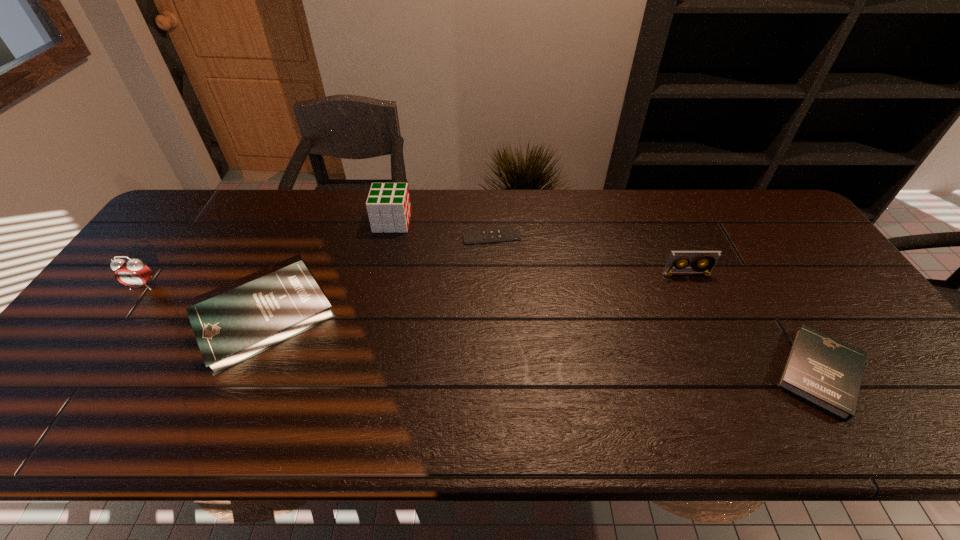
Locate an element on the screen. vacant point located between the leftmost object and the fifth object from left to right is located at coordinates (415, 280).

The image size is (960, 540). Identify the location of free space between the left book and the rightmost object. (542, 345).

Identify the location of free space between the shorter book and the videotape. (754, 323).

Where is `free space that is in between the fourth tallest object and the videotape`? The height and width of the screenshot is (540, 960). free space that is in between the fourth tallest object and the videotape is located at coordinates (475, 296).

Locate an element on the screen. The height and width of the screenshot is (540, 960). free space between the second shortest object and the shortest object is located at coordinates (656, 305).

Select which object appears as the fourth closest to the taller book. Please provide its 2D coordinates. Your answer should be formatted as a tuple, i.e. [(x, y)], where the tuple contains the x and y coordinates of a point satisfying the conditions above.

[(709, 259)]

Image resolution: width=960 pixels, height=540 pixels. In order to click on object that is the second closest to the taller book in this screenshot , I will do `click(388, 205)`.

This screenshot has width=960, height=540. Identify the location of free space in the image that satisfies the following two spatial constraints: 1. on the red face of the cube; 2. on the right side of the third object from right to left. (389, 237).

Find the location of a particular element. free location that satisfies the following two spatial constraints: 1. on the front side of the left book; 2. on the right side of the right book is located at coordinates (240, 373).

The height and width of the screenshot is (540, 960). What are the coordinates of `vacant area in the image that satisfies the following two spatial constraints: 1. on the red face of the third object from left to right; 2. on the right side of the remote control` in the screenshot? It's located at (389, 237).